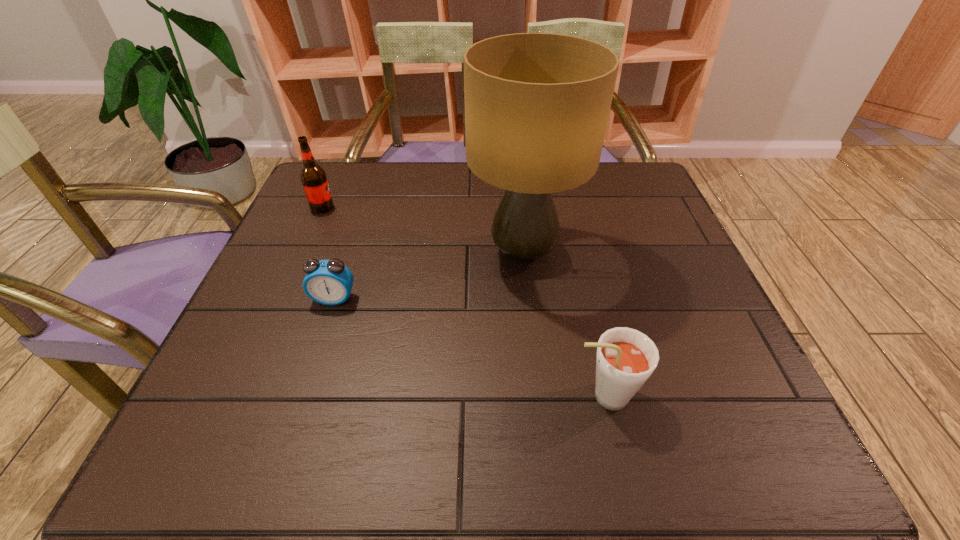
Where is `the tallest object`? This screenshot has width=960, height=540. the tallest object is located at coordinates [x=537, y=105].

Where is `the farther root beer`? The image size is (960, 540). the farther root beer is located at coordinates (313, 177).

What are the coordinates of `the farthest object` in the screenshot? It's located at (313, 177).

I want to click on the shorter root beer, so click(x=625, y=359).

This screenshot has height=540, width=960. I want to click on the nearer root beer, so click(625, 359).

I want to click on alarm clock, so click(329, 282).

Find the location of a particular element. This screenshot has height=540, width=960. the second object from left to right is located at coordinates (329, 282).

Image resolution: width=960 pixels, height=540 pixels. What are the coordinates of `vacant area situated 0.140m on the back of the lampshade` in the screenshot? It's located at (516, 188).

Where is `free point located on the back of the farthest object`? The image size is (960, 540). free point located on the back of the farthest object is located at coordinates (336, 177).

Identify the location of vacant region located 0.380m on the drink side of the shorter root beer. (348, 396).